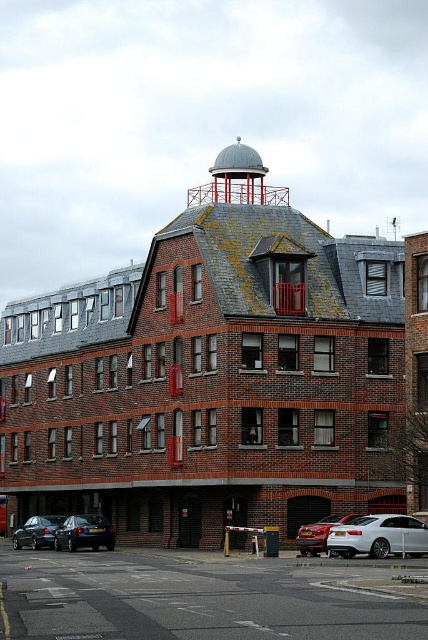
You are a delivery driver who needs to park your vehicle between the silver metallic sedan at lower right and the shiny black car at lower left. Your truck is 2.5 meters wide. Can you fit your truck between them?

The silver metallic sedan at lower right is narrower than the shiny black car at lower left. However, the exact distance between them isn

You are standing at the front entrance of the building and want to park your car in the closest available spot. Where is the silver metallic sedan at lower right located relative to your position?

The silver metallic sedan at lower right is located at coordinates point (379, 536) relative to your position.

You are standing in front of the building and notice two points marked on the facade. The first point is at coordinates point [56,548] and the second is at point [38,518]. Which point is closer to your current position?

Point [38,518] is closer to your current position because it is less further to the camera than point [56,548].